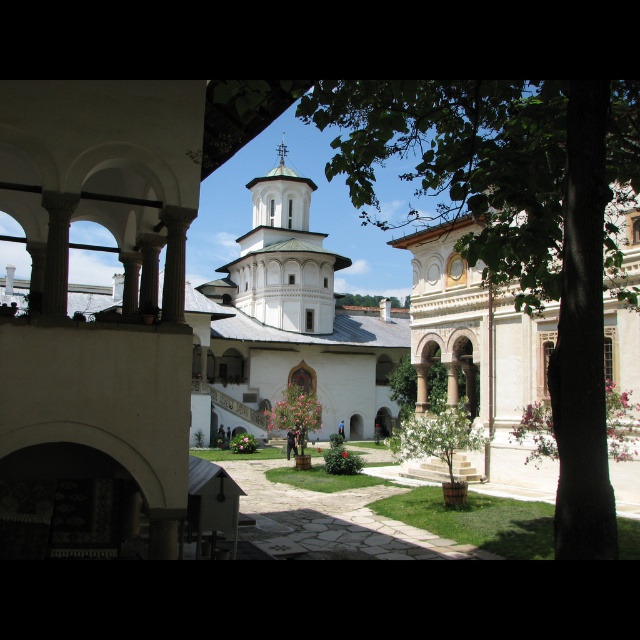
Question: Which of the following is the closest to the observer?

Choices:
 (A) (272, 216)
 (B) (508, 193)

Answer: (B)

Question: Does green leafy tree at center appear over white smooth tower at center?

Choices:
 (A) no
 (B) yes

Answer: (B)

Question: Can you confirm if green leafy tree at center is bigger than white smooth tower at center?

Choices:
 (A) no
 (B) yes

Answer: (B)

Question: Can you confirm if green leafy tree at center is positioned above white smooth tower at center?

Choices:
 (A) no
 (B) yes

Answer: (B)